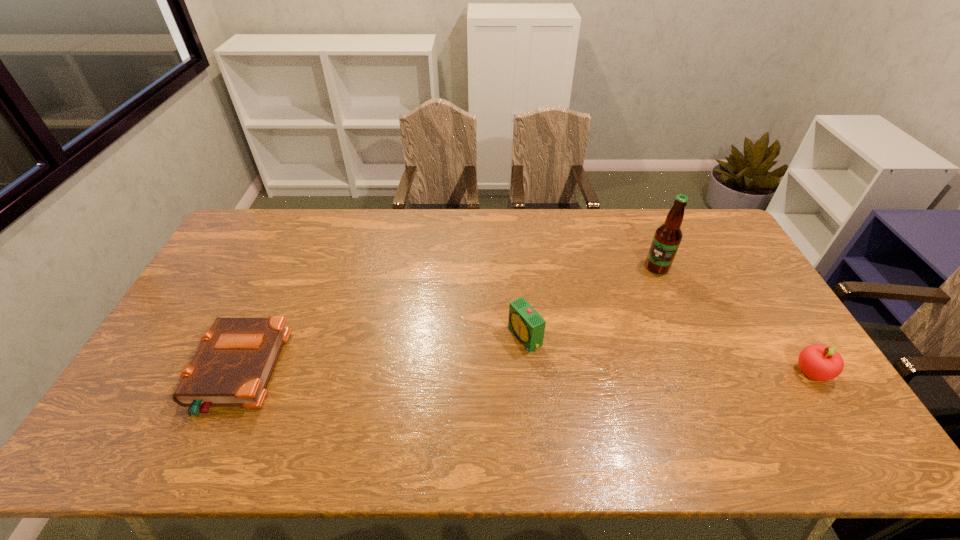
You are a GUI agent. You are given a task and a screenshot of the screen. Output one action in this format:
    pyautogui.click(x=<x>, y=<y>)
    Task: Click on the vacant spot on the desktop that is between the Bible and the rightmost object and is positioned on the label of the beer bottle
    This screenshot has height=540, width=960.
    Given the screenshot: What is the action you would take?
    pyautogui.click(x=472, y=372)

The image size is (960, 540). Find the location of `vacant space on the desktop that is between the shortest object and the apple and is positioned on the front-facing side of the alarm clock`. vacant space on the desktop that is between the shortest object and the apple and is positioned on the front-facing side of the alarm clock is located at coordinates (456, 372).